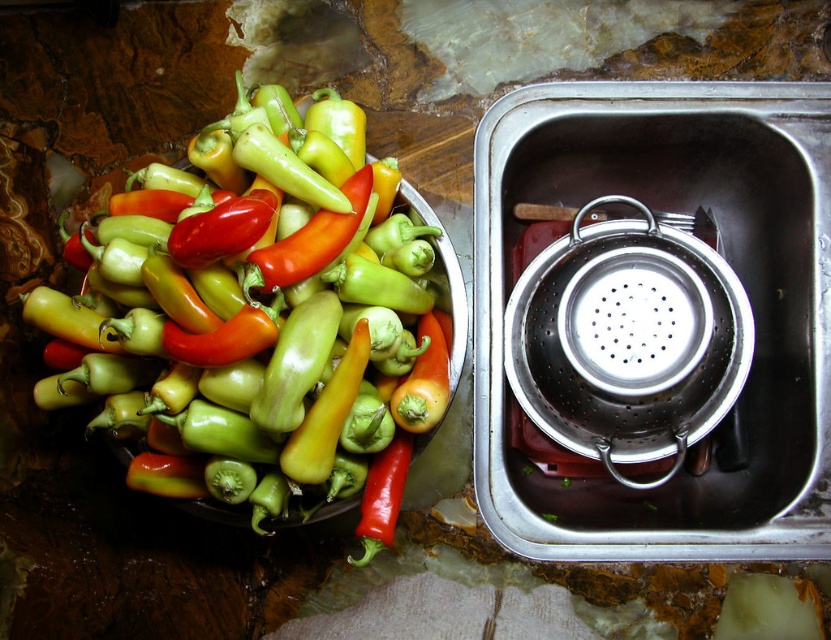
Which is in front, point (210, 184) or point (600, 177)?

Point (210, 184) is in front.

Between glossy green bell pepper at upper left and stainless steel colander at right, which one is positioned higher?

Positioned higher is glossy green bell pepper at upper left.

Which is in front, point (123, 417) or point (493, 456)?

Point (123, 417)

This screenshot has height=640, width=831. I want to click on glossy green bell pepper at upper left, so click(x=258, y=307).

Can you confirm if stainless steel colander at right is taller than silver metallic strainer at right?

Yes.

Who is taller, stainless steel colander at right or silver metallic strainer at right?

Standing taller between the two is stainless steel colander at right.

Who is more forward, (593, 540) or (652, 280)?

Point (652, 280)

Identify the location of stainless steel colander at right. The width and height of the screenshot is (831, 640). (726, 260).

Can you confirm if glossy green bell pepper at upper left is bigger than silver metallic strainer at right?

Correct, glossy green bell pepper at upper left is larger in size than silver metallic strainer at right.

Does glossy green bell pepper at upper left appear under silver metallic strainer at right?

No.

Locate an element on the screen. glossy green bell pepper at upper left is located at coordinates (258, 307).